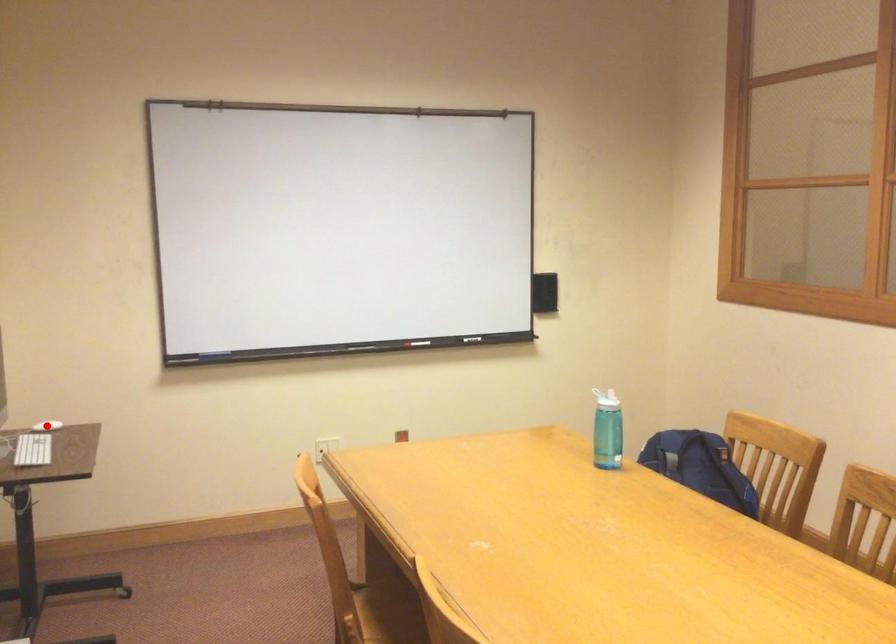
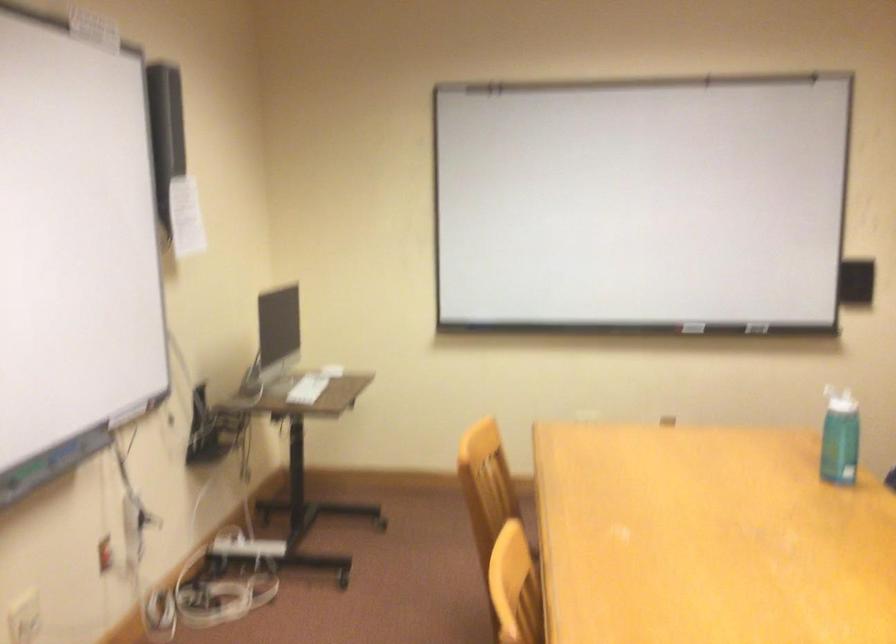
Question: I am providing you with two images of the same scene from different viewpoints. A red point is marked on the first image. Is the red point's position out of view in image 2?

Choices:
 (A) Yes
 (B) No

Answer: (A)